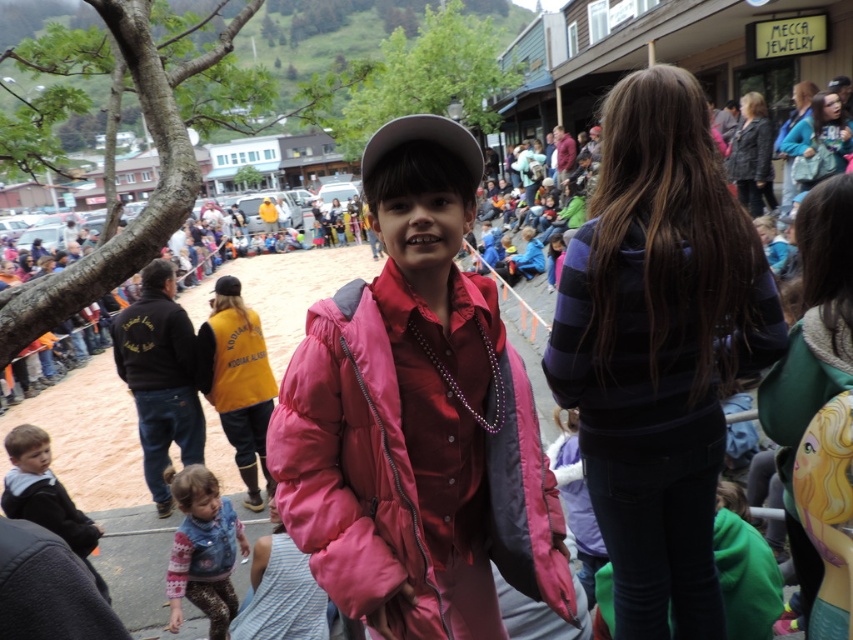
You are standing at the camera position and want to take a photo of the point at coordinate (717, 211). Is the point within your field of view?

The point at coordinate (717, 211) is 7.71 feet away from the camera, so it is within the field of view.

Consider the image. You are a photographer at the event and want to capture a photo of the denim vest at lower left without the yellow fabric vest at lower left blocking it. Is this possible?

The denim vest at lower left is behind the yellow fabric vest at lower left, so it cannot be captured without the yellow fabric vest at lower left blocking it.

Consider the image. You are a photographer at this event. You need to capture a photo that includes both the denim vest at lower left and the gray matte baseball cap at center. Your camera has a maximum focus range of 3 meters. Can you fit both subjects in the same frame without moving your position?

The distance between the denim vest at lower left and the gray matte baseball cap at center is 3.25 meters. Since your camera can only focus up to 3 meters, the subjects are slightly out of range. You might need to move closer or use a different camera setting to capture both.